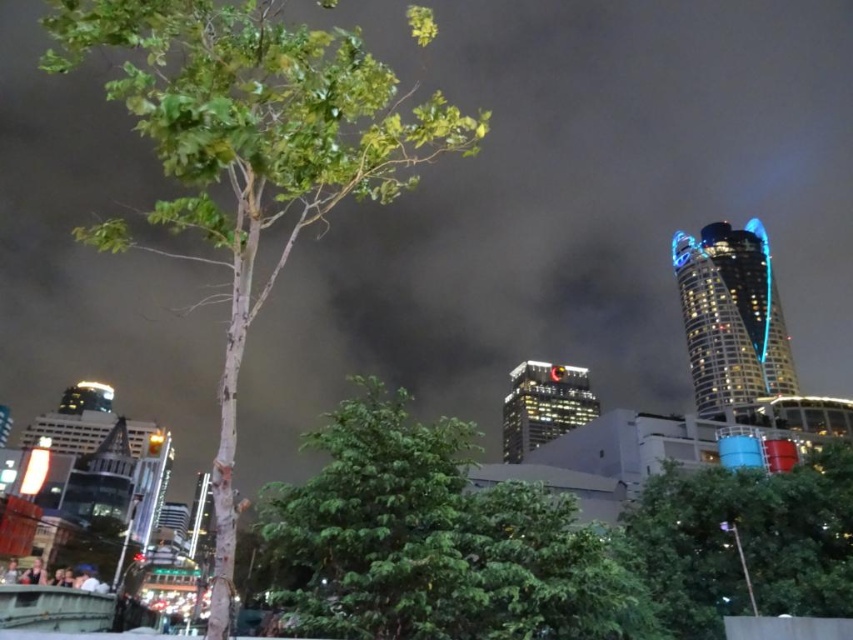
You are a city planner analyzing the urban layout. You need to determine which of the two green leafy trees, the green leafy tree at center or the green leafy tree at lower right, would cast a larger shadow during the day. Based on their sizes, which one would you expect to have a bigger shadow?

The green leafy tree at center is much taller than the green leafy tree at lower right, so it would cast a larger shadow during the day.

You are a photographer trying to capture the city lights behind the trees. Which tree, the green leafy tree at center or the green leafy tree at lower right, would block less of the city view if you position your camera to focus on the cityscape?

The green leafy tree at lower right is further away than the green leafy tree at center, so positioning the camera to focus on the cityscape would result in the green leafy tree at center blocking less of the view since it is closer and might be smaller in the frame compared to the one behind it.